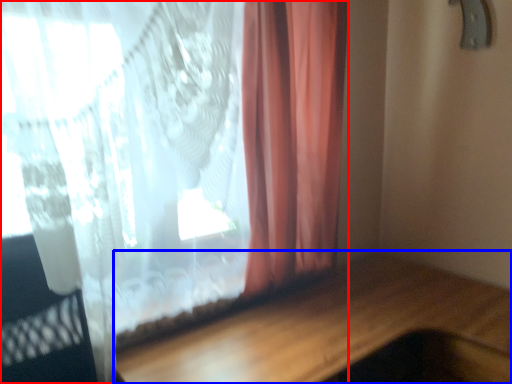
Question: Among these objects, which one is nearest to the camera, curtain (highlighted by a red box) or table (highlighted by a blue box)?

Choices:
 (A) curtain
 (B) table

Answer: (B)